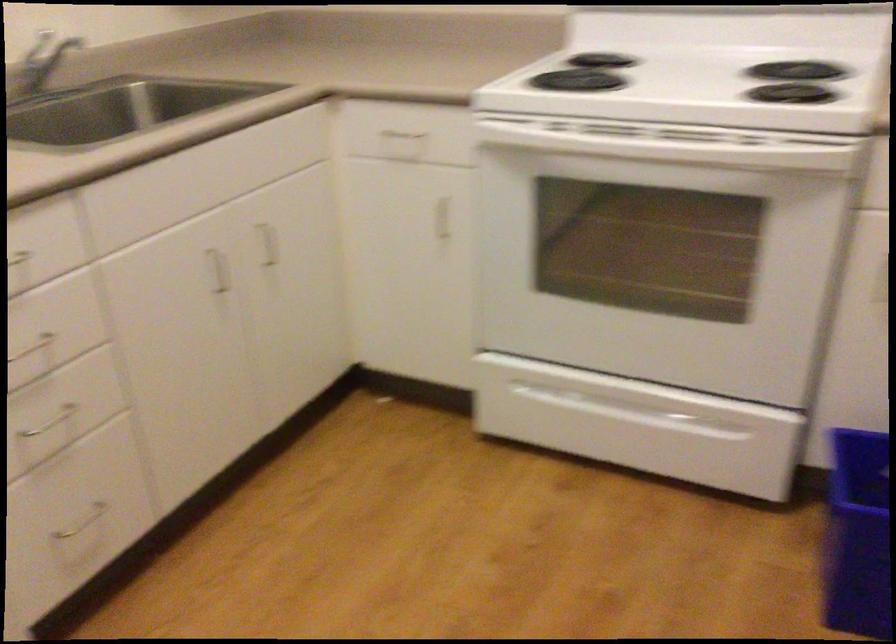
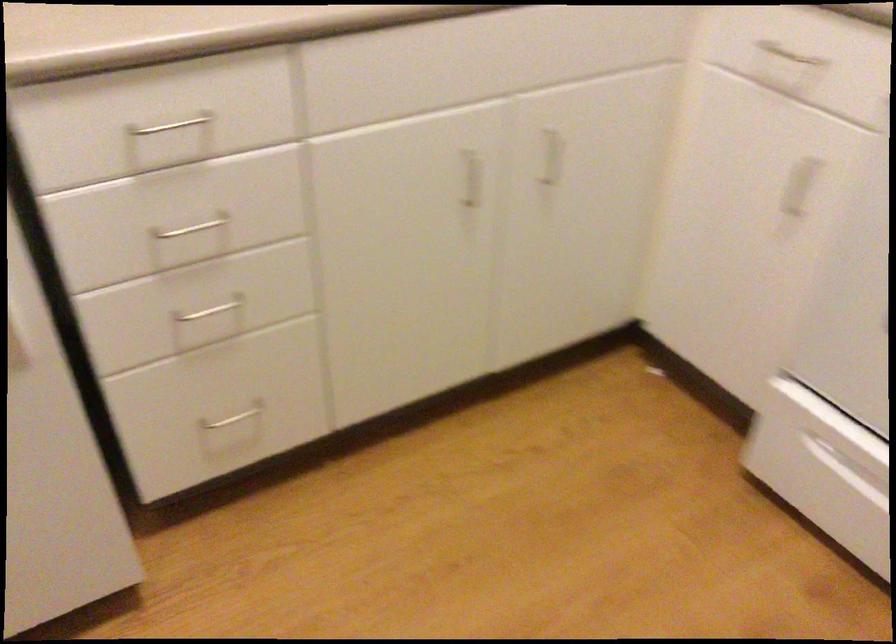
Locate, in the second image, the point that corresponds to [213,272] in the first image.

(471, 178)